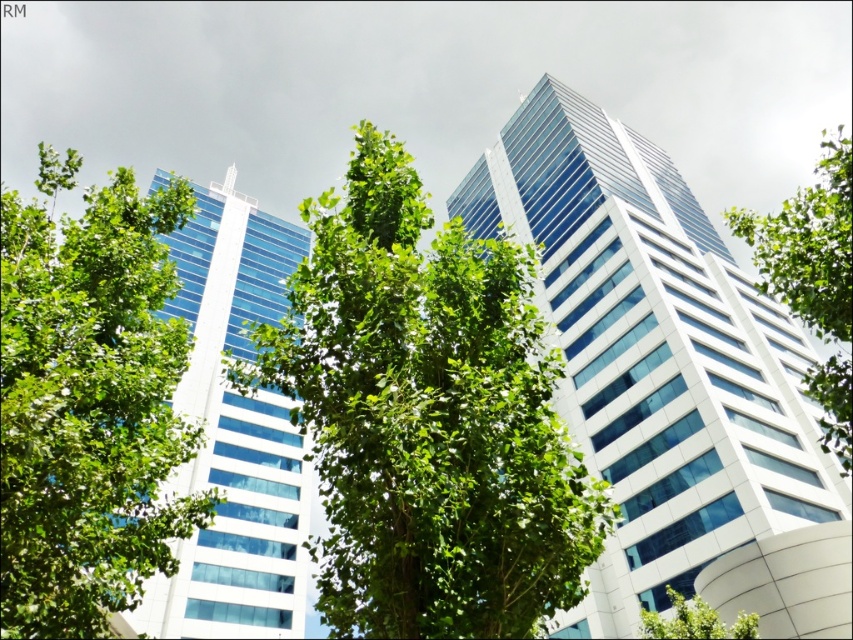
Question: Observing the image, what is the correct spatial positioning of green leafy tree at left in reference to green leafy tree at right?

Choices:
 (A) below
 (B) above

Answer: (A)

Question: Does glassy white skyscraper at center have a larger size compared to glassy blue skyscraper at left?

Choices:
 (A) no
 (B) yes

Answer: (A)

Question: Among these points, which one is farthest from the camera?

Choices:
 (A) (432, 493)
 (B) (67, 355)

Answer: (B)

Question: Does green leafy tree at right come in front of green leafy tree at lower right?

Choices:
 (A) no
 (B) yes

Answer: (B)

Question: Which of these objects is positioned closest to the green leafy tree at right?

Choices:
 (A) green leafy tree at center
 (B) glassy white skyscraper at center
 (C) green leafy tree at lower right
 (D) green leafy tree at left

Answer: (B)

Question: Which object is the farthest from the glassy white skyscraper at center?

Choices:
 (A) green leafy tree at lower right
 (B) green leafy tree at center

Answer: (A)